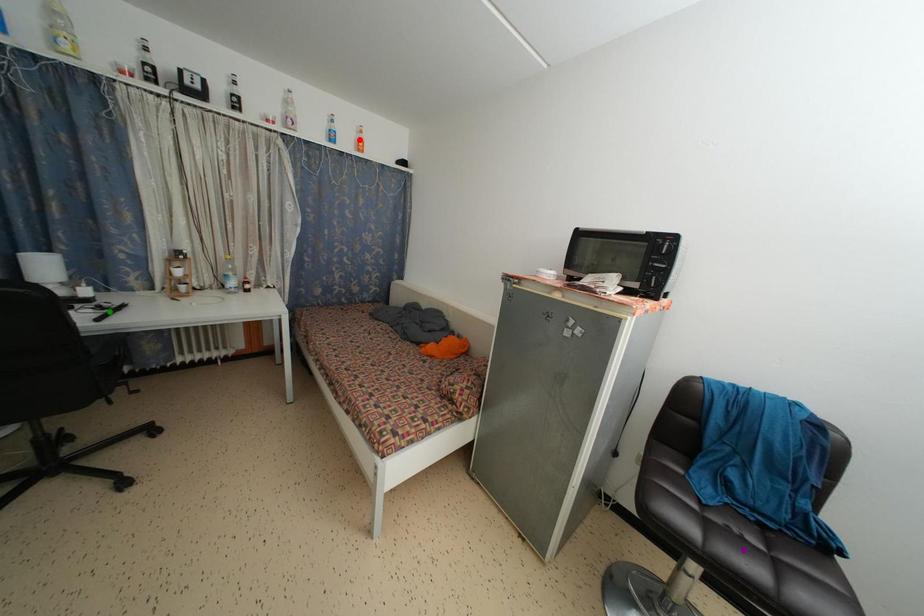
Order these from nearest to farthest:
- green point
- purple point
- red point

→ red point < green point < purple point